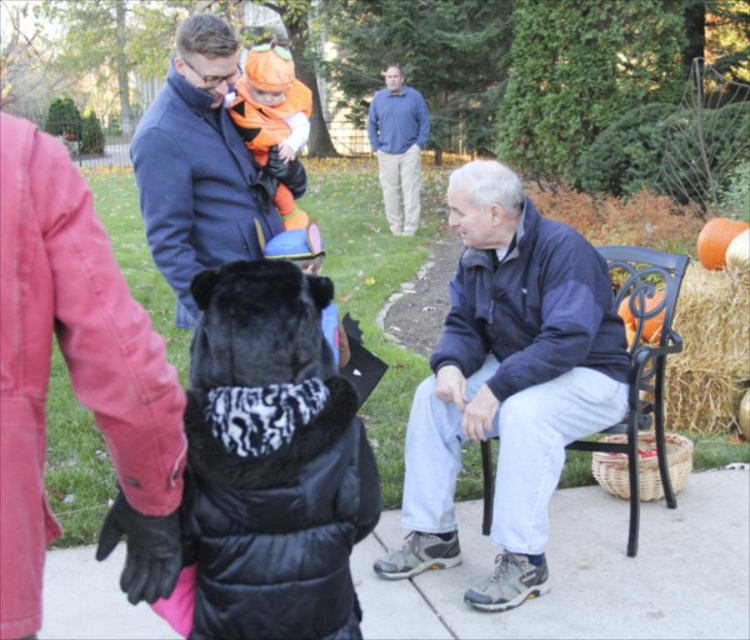
Between navy blue jacket at center and black wrought iron chair at right, which one appears on the right side from the viewer's perspective?

black wrought iron chair at right

Is point (435, 440) positioned before point (644, 300)?

Yes, it is.

Locate an element on the screen. navy blue jacket at center is located at coordinates (507, 381).

Who is lower down, haybrown at right or blue cotton shirt at upper center?

haybrown at right is below.

Which is more to the right, haybrown at right or blue cotton shirt at upper center?

Positioned to the right is haybrown at right.

Is point (693, 292) less distant than point (387, 96)?

Yes, it is.

At what (x,y) coordinates should I click in order to perform the action: click on haybrown at right. Please return your answer as a coordinate pair (x, y). Looking at the image, I should click on coord(708,349).

Between velvet blue coat at upper left and blue cotton shirt at upper center, which one appears on the right side from the viewer's perspective?

blue cotton shirt at upper center

What do you see at coordinates (202, 166) in the screenshot?
I see `velvet blue coat at upper left` at bounding box center [202, 166].

Locate an element on the screen. This screenshot has height=640, width=750. velvet blue coat at upper left is located at coordinates (202, 166).